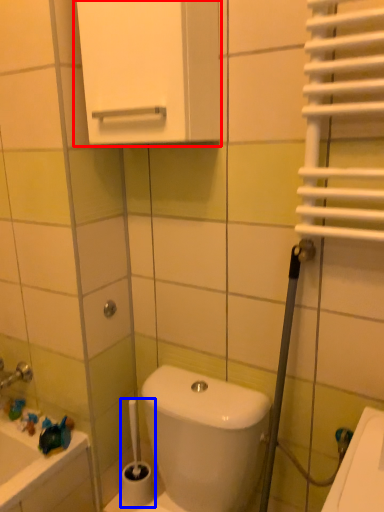
Question: Which of the following is the closest to the observer, medicine cabinet (highlighted by a red box) or brush (highlighted by a blue box)?

Choices:
 (A) medicine cabinet
 (B) brush

Answer: (A)